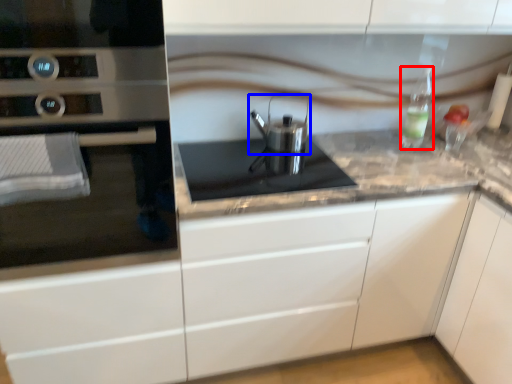
Question: Which object is closer to the camera taking this photo, bottle (highlighted by a red box) or kitchen appliance (highlighted by a blue box)?

Choices:
 (A) bottle
 (B) kitchen appliance

Answer: (B)